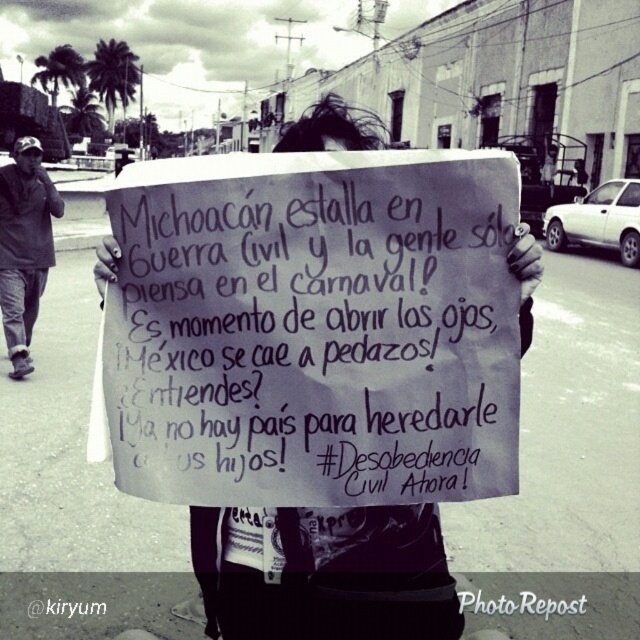
Question: Which point is closer to the camera?

Choices:
 (A) (26, 308)
 (B) (369, 497)

Answer: (B)

Question: Which point is closer to the camera?

Choices:
 (A) (352, 200)
 (B) (51, 196)

Answer: (A)

Question: Considering the relative positions of handwritten paper sign at center and dark gray jacket at left in the image provided, where is handwritten paper sign at center located with respect to dark gray jacket at left?

Choices:
 (A) above
 (B) below

Answer: (B)

Question: Can you confirm if handwritten paper sign at center is bigger than dark gray jacket at left?

Choices:
 (A) yes
 (B) no

Answer: (B)

Question: Which point is closer to the camera?

Choices:
 (A) (35, 232)
 (B) (328, 500)

Answer: (B)

Question: Does handwritten paper sign at center appear on the left side of dark gray jacket at left?

Choices:
 (A) yes
 (B) no

Answer: (B)